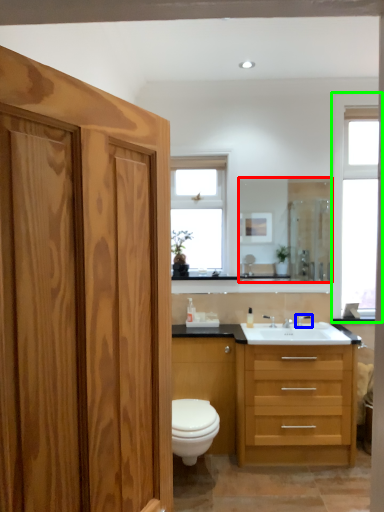
Question: Based on their relative distances, which object is farther from mirror (highlighted by a red box)? Choose from faucet (highlighted by a blue box) and window (highlighted by a green box).

Choices:
 (A) faucet
 (B) window

Answer: (A)